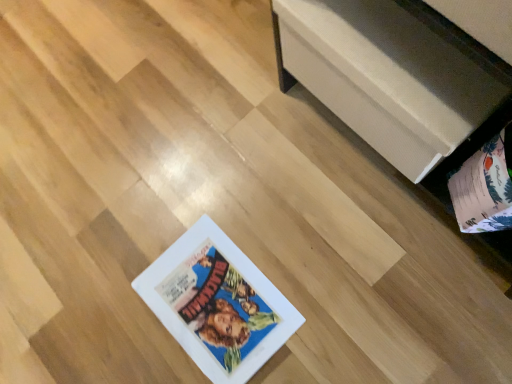
Image resolution: width=512 pixels, height=384 pixels. I want to click on white matte storage chest at upper right, so click(x=390, y=75).

Image resolution: width=512 pixels, height=384 pixels. What do you see at coordinates (390, 75) in the screenshot? I see `white matte storage chest at upper right` at bounding box center [390, 75].

This screenshot has width=512, height=384. What do you see at coordinates (483, 189) in the screenshot?
I see `matte paper album at lower right` at bounding box center [483, 189].

What are the coordinates of `matte paper album at lower right` in the screenshot? It's located at (483, 189).

At what (x,y) coordinates should I click in order to perform the action: click on white matte storage chest at upper right. Please return your answer as a coordinate pair (x, y). This screenshot has height=384, width=512. Looking at the image, I should click on (390, 75).

Considering the relative positions of white matte storage chest at upper right and matte paper album at lower right in the image provided, is white matte storage chest at upper right to the right of matte paper album at lower right from the viewer's perspective?

Incorrect, white matte storage chest at upper right is not on the right side of matte paper album at lower right.

Consider the image. Does white matte storage chest at upper right lie behind matte paper album at lower right?

That is True.

Which point is more forward, (435,140) or (467,160)?

The point (435,140) is closer to the camera.

From the image's perspective, does white matte storage chest at upper right appear lower than matte paper album at lower right?

No, from the image's perspective, white matte storage chest at upper right is not beneath matte paper album at lower right.

From a real-world perspective, is white matte storage chest at upper right positioned above or below matte paper album at lower right?

white matte storage chest at upper right is situated higher than matte paper album at lower right in the real world.

Which of these two, white matte storage chest at upper right or matte paper album at lower right, is wider?

With larger width is matte paper album at lower right.

Can you confirm if white matte storage chest at upper right is taller than matte paper album at lower right?

No, white matte storage chest at upper right is not taller than matte paper album at lower right.

Considering the sizes of objects white matte storage chest at upper right and matte paper album at lower right in the image provided, who is bigger, white matte storage chest at upper right or matte paper album at lower right?

white matte storage chest at upper right.

Is matte paper album at lower right surrounded by white matte storage chest at upper right?

No, matte paper album at lower right is not inside white matte storage chest at upper right.

Based on the photo, is white matte storage chest at upper right positioned far away from matte paper album at lower right?

No, white matte storage chest at upper right is not far away from matte paper album at lower right.

Is white matte storage chest at upper right oriented towards matte paper album at lower right?

No.

Measure the distance between white matte storage chest at upper right and matte paper album at lower right.

white matte storage chest at upper right is 6.78 inches away from matte paper album at lower right.

At what (x,y) coordinates should I click in order to perform the action: click on album that appears below the white matte storage chest at upper right (from a real-world perspective). Please return your answer as a coordinate pair (x, y). The height and width of the screenshot is (384, 512). Looking at the image, I should click on (483, 189).

Which object is positioned more to the right, matte paper album at lower right or white matte storage chest at upper right?

matte paper album at lower right is more to the right.

Is matte paper album at lower right further to the viewer compared to white matte storage chest at upper right?

No, the depth of matte paper album at lower right is less than that of white matte storage chest at upper right.

Considering the positions of point (460, 180) and point (325, 97), is point (460, 180) closer or farther from the camera than point (325, 97)?

Point (460, 180) is positioned closer to the camera compared to point (325, 97).

From the image's perspective, would you say matte paper album at lower right is positioned over white matte storage chest at upper right?

Incorrect, from the image's perspective, matte paper album at lower right is lower than white matte storage chest at upper right.

From a real-world perspective, which object rests below the other?

From a 3D spatial view, matte paper album at lower right is below.

Does matte paper album at lower right have a lesser width compared to white matte storage chest at upper right?

No, matte paper album at lower right is not thinner than white matte storage chest at upper right.

In terms of height, does matte paper album at lower right look taller or shorter compared to white matte storage chest at upper right?

In the image, matte paper album at lower right appears to be taller than white matte storage chest at upper right.

Is matte paper album at lower right bigger than white matte storage chest at upper right?

No, matte paper album at lower right is not bigger than white matte storage chest at upper right.

Is matte paper album at lower right inside or outside of white matte storage chest at upper right?

matte paper album at lower right is not enclosed by white matte storage chest at upper right.

Consider the image. Are matte paper album at lower right and white matte storage chest at upper right far apart?

No, there isn't a large distance between matte paper album at lower right and white matte storage chest at upper right.

Is matte paper album at lower right aimed at white matte storage chest at upper right?

No.

How different are the orientations of matte paper album at lower right and white matte storage chest at upper right in degrees?

The angle between the facing direction of matte paper album at lower right and the facing direction of white matte storage chest at upper right is 2.12 degrees.

The image size is (512, 384). I want to click on furniture above the matte paper album at lower right (from a real-world perspective), so click(390, 75).

This screenshot has height=384, width=512. I want to click on furniture above the matte paper album at lower right (from a real-world perspective), so click(x=390, y=75).

You are a GUI agent. You are given a task and a screenshot of the screen. Output one action in this format:
    pyautogui.click(x=<x>, y=<y>)
    Task: Click on the album below the white matte storage chest at upper right (from the image's perspective)
    
    Given the screenshot: What is the action you would take?
    pyautogui.click(x=483, y=189)